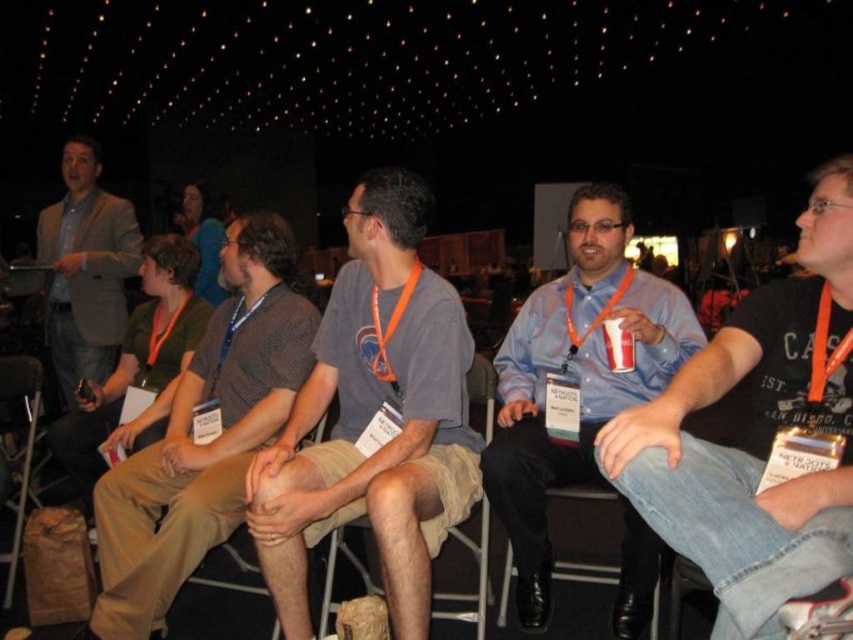
You are standing in the conference room and want to determine which of the two points, point (x=442, y=340) or point (x=577, y=291), is nearer to you. Based on the scene description, which point is closer?

Point (x=442, y=340) is closer to the camera than point 0.458, 0.678, so it is the nearer one.